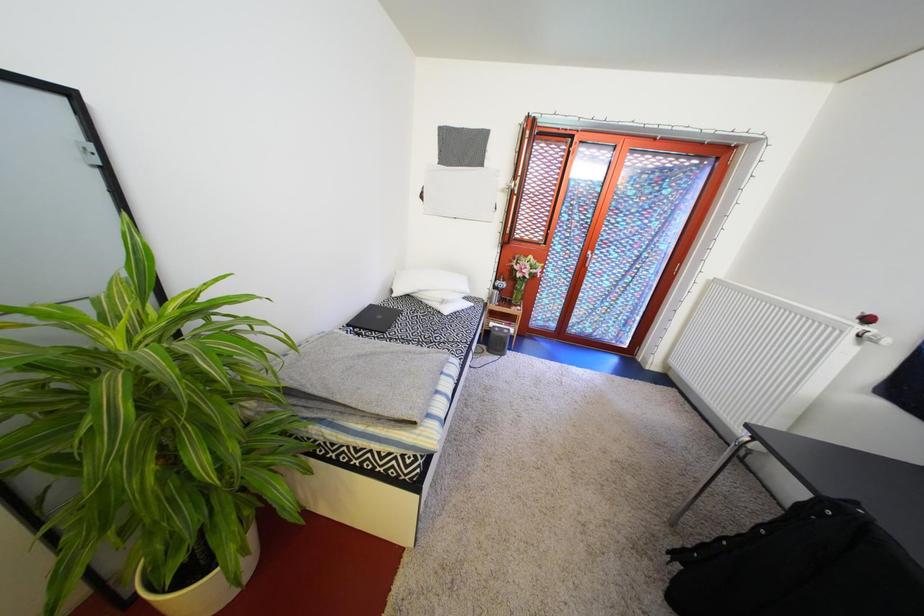
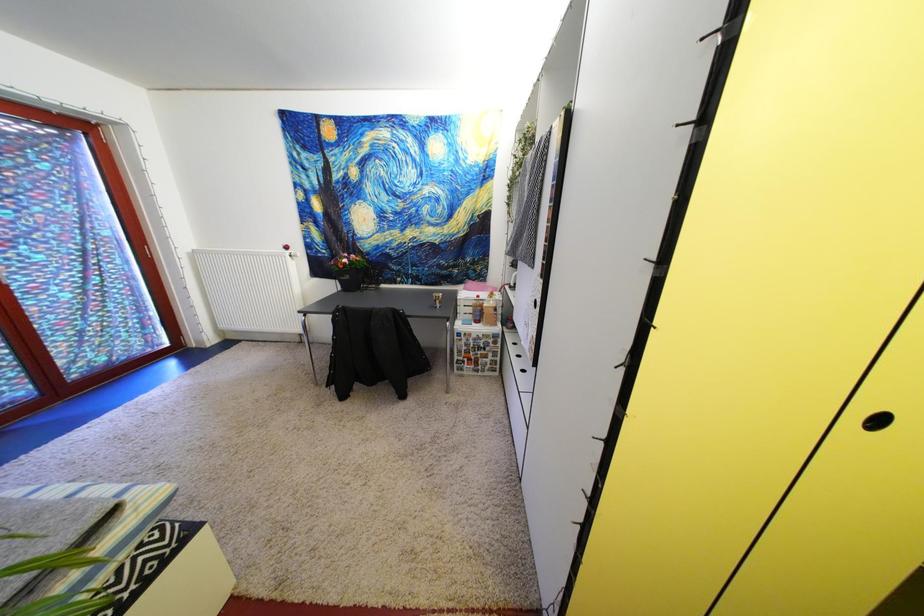
The first image is from the beginning of the video and the second image is from the end. How did the camera likely rotate when shooting the video?

The camera's rotation is toward right-down.